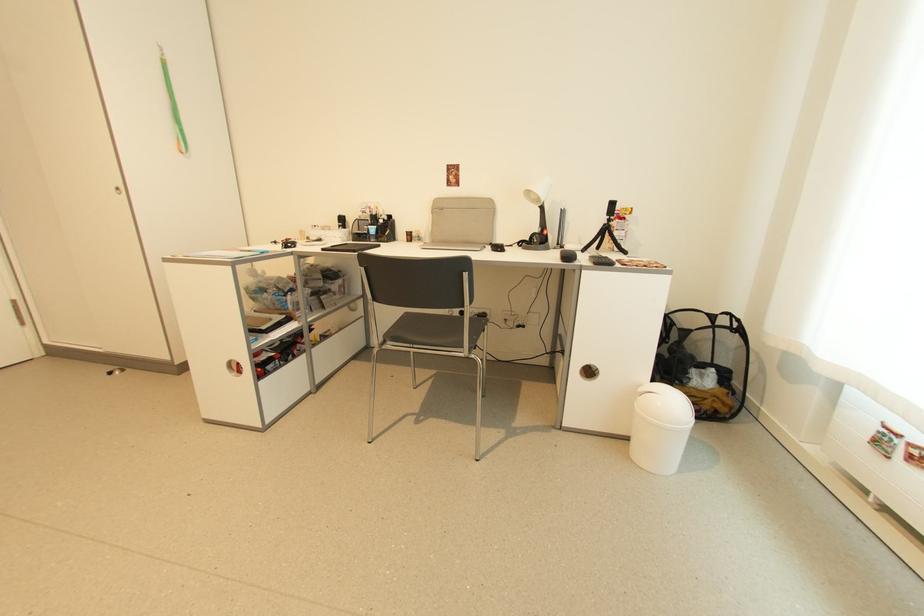
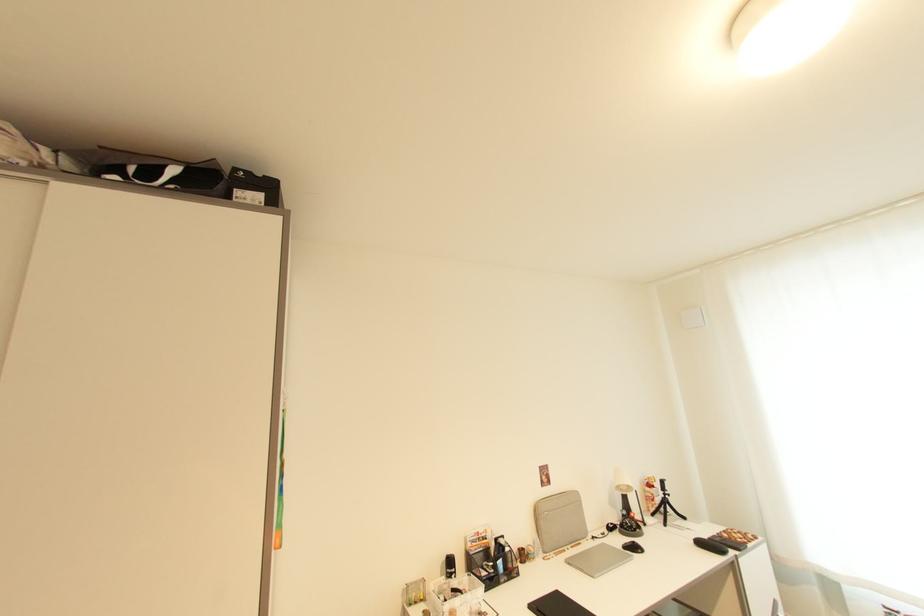
Find the pixel in the second image that matches the point at 612,224 in the first image.

(669, 498)